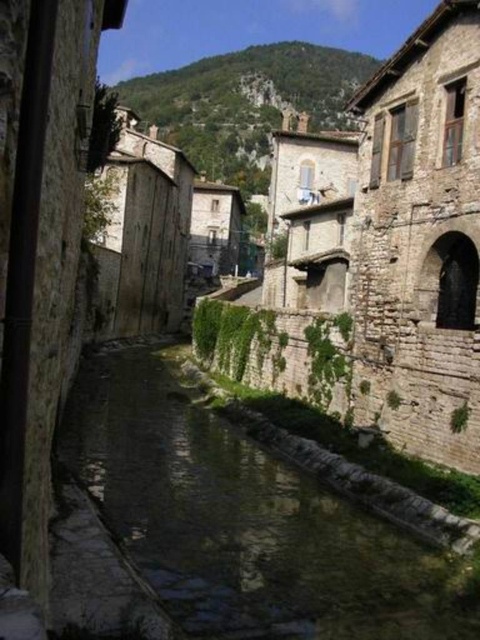
Is point (400, 577) positioned behind point (250, 76)?

That is False.

Who is lower down, green mossy stone stream at center or rustic stone hillside at upper center?

Positioned lower is green mossy stone stream at center.

At what (x,y) coordinates should I click in order to perform the action: click on green mossy stone stream at center. Please return your answer as a coordinate pair (x, y). Looking at the image, I should click on (243, 522).

Locate an element on the screen. green mossy stone stream at center is located at coordinates (243, 522).